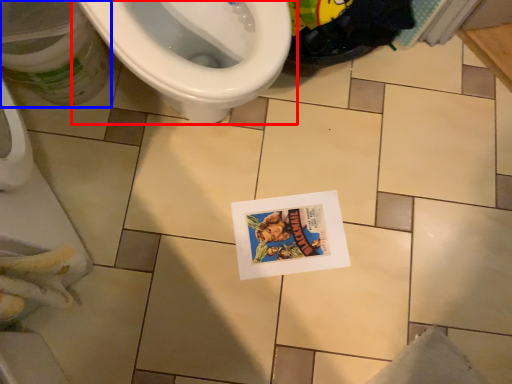
Question: Which of the following is the closest to the observer, toilet (highlighted by a red box) or potty (highlighted by a blue box)?

Choices:
 (A) toilet
 (B) potty

Answer: (A)